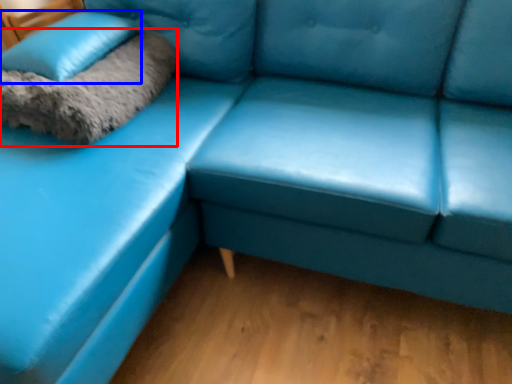
Question: Which of the following is the closest to the observer, blanket (highlighted by a red box) or pillow (highlighted by a blue box)?

Choices:
 (A) blanket
 (B) pillow

Answer: (A)